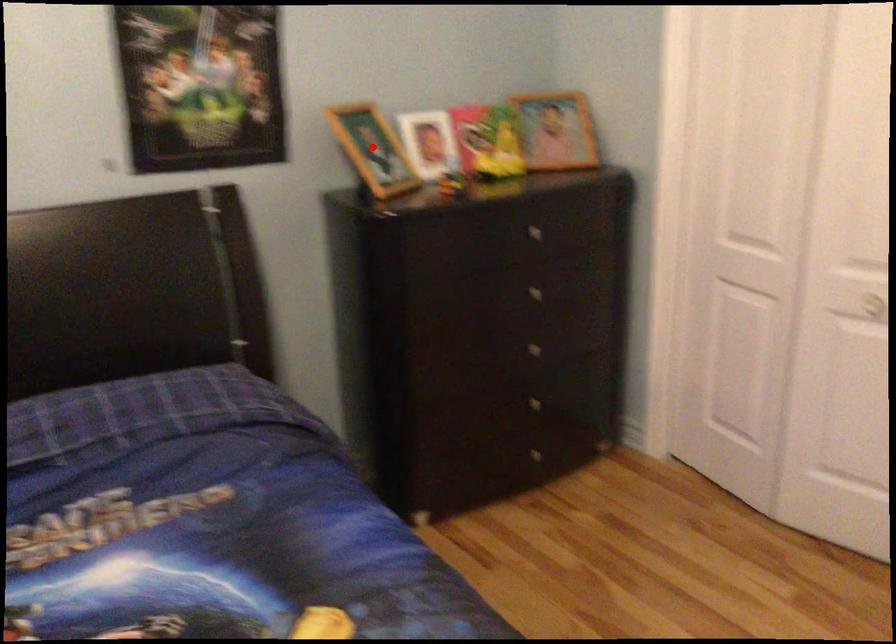
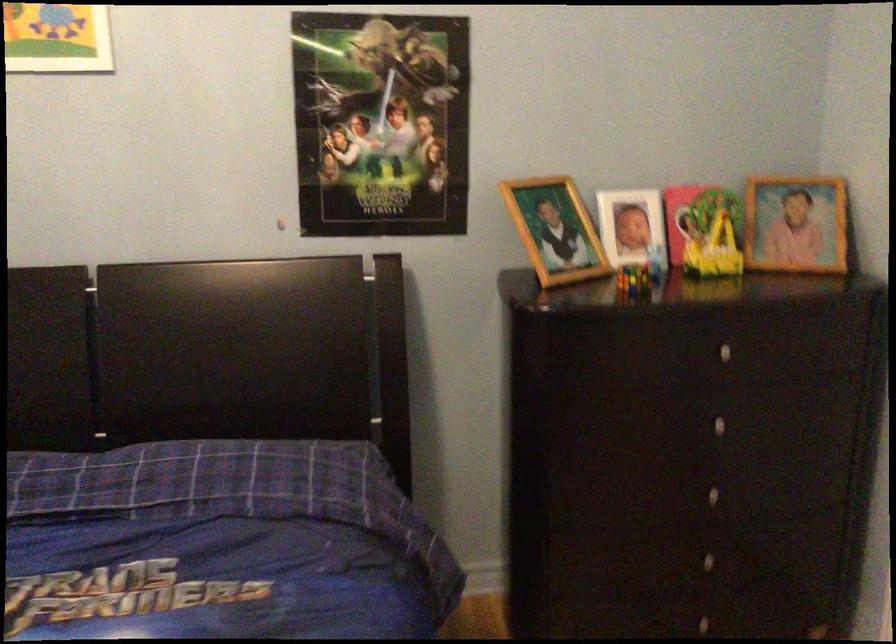
Question: I am providing you with two images of the same scene from different viewpoints. In image1, a red point is highlighted. Considering the same 3D point in image2, which of the following is correct?

Choices:
 (A) It is closer
 (B) It is farther

Answer: (A)